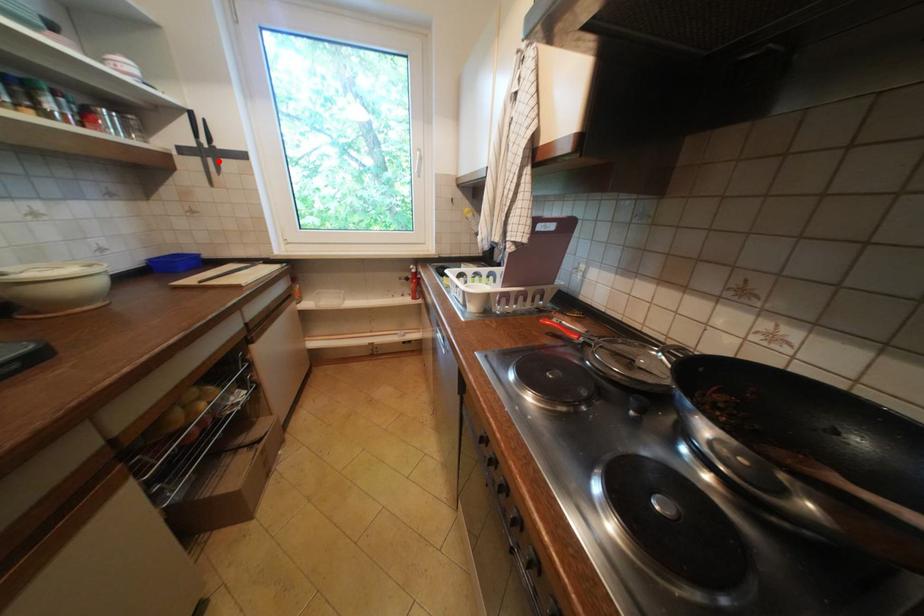
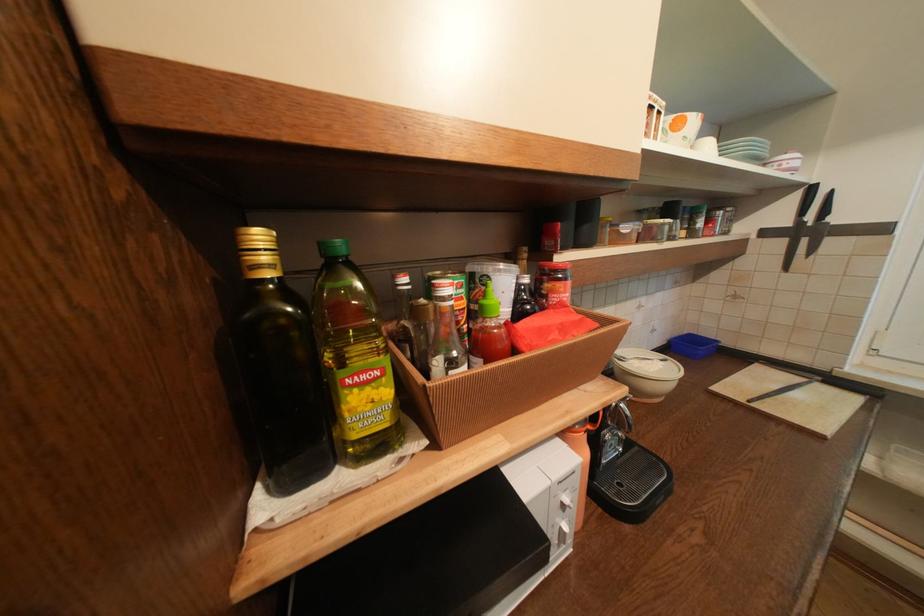
Find the pixel in the second image that matches the highlighted location in the first image.

(812, 241)